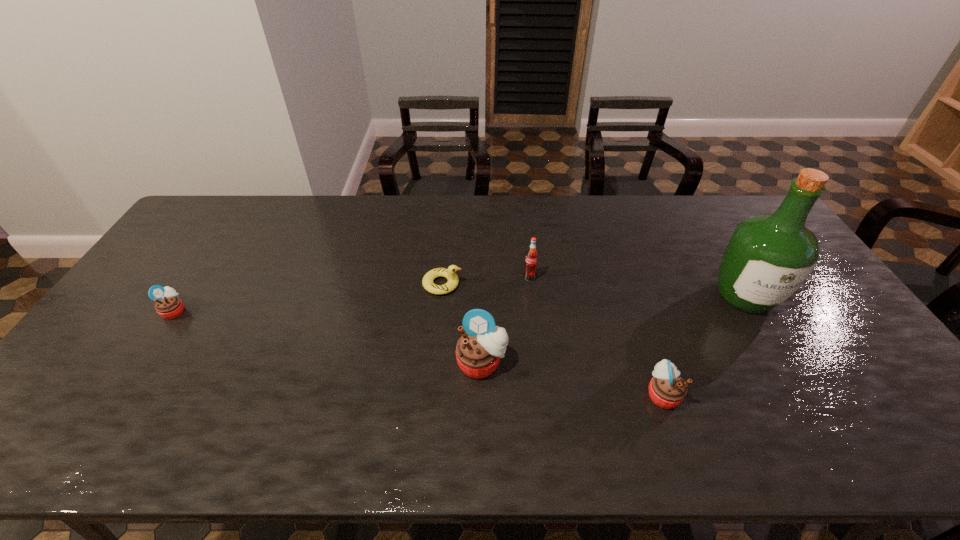
To achieve even spacing by inserting another muffin among them, please point to a vacant spot for this new muffin. Please provide its 2D coordinates. Your answer should be formatted as a tuple, i.e. [(x, y)], where the tuple contains the x and y coordinates of a point satisfying the conditions above.

[(320, 336)]